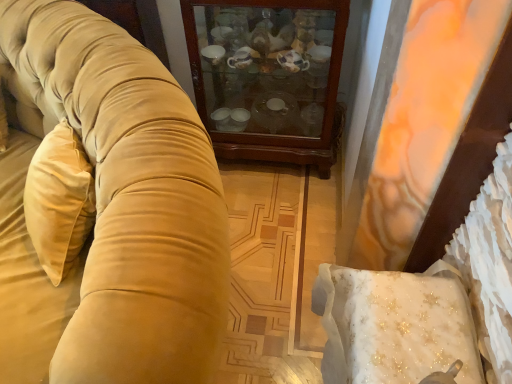
Question: Is velvet gold couch at left wider or thinner than wooden cabinet at center?

Choices:
 (A) wide
 (B) thin

Answer: (A)

Question: From their relative heights in the image, would you say velvet gold couch at left is taller or shorter than wooden cabinet at center?

Choices:
 (A) short
 (B) tall

Answer: (B)

Question: Based on their sizes in the image, would you say velvet gold couch at left is bigger or smaller than wooden cabinet at center?

Choices:
 (A) big
 (B) small

Answer: (A)

Question: In terms of width, does wooden cabinet at center look wider or thinner when compared to velvet gold couch at left?

Choices:
 (A) wide
 (B) thin

Answer: (B)

Question: Is wooden cabinet at center spatially inside velvet gold couch at left, or outside of it?

Choices:
 (A) outside
 (B) inside

Answer: (A)

Question: Would you say wooden cabinet at center is to the left or to the right of velvet gold couch at left in the picture?

Choices:
 (A) right
 (B) left

Answer: (A)

Question: From a real-world perspective, is wooden cabinet at center positioned above or below velvet gold couch at left?

Choices:
 (A) above
 (B) below

Answer: (B)